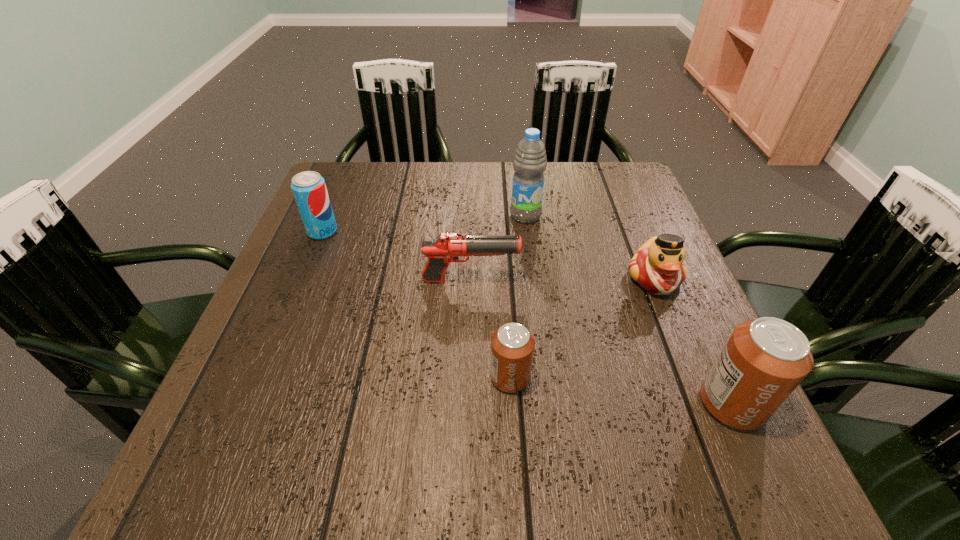
The width and height of the screenshot is (960, 540). I want to click on the shorter can, so click(x=512, y=345).

Locate an element on the screen. the right can is located at coordinates (764, 360).

Where is `the fifth shortest object`? the fifth shortest object is located at coordinates (764, 360).

At what (x,y) coordinates should I click in order to perform the action: click on soda can. Please return your answer as a coordinate pair (x, y). Looking at the image, I should click on (309, 189).

Identify the location of water bottle. (530, 160).

Identify the location of duck. (657, 266).

Identify the location of gun. This screenshot has height=540, width=960. (447, 247).

This screenshot has height=540, width=960. I want to click on free region located 0.060m on the left of the shorter can, so click(x=457, y=377).

Find the location of a particular element. This screenshot has height=540, width=960. free space located on the back of the taller can is located at coordinates (667, 261).

Where is `free location located 0.360m on the front of the leftmost object`? The image size is (960, 540). free location located 0.360m on the front of the leftmost object is located at coordinates (267, 366).